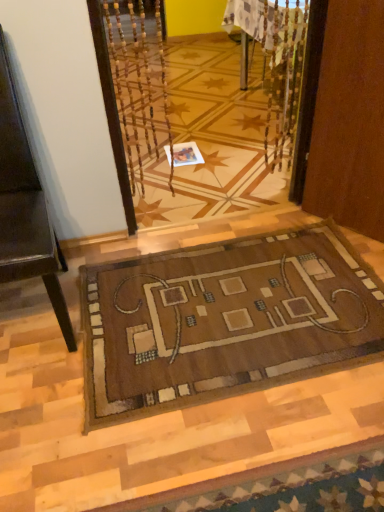
Question: From a real-world perspective, is brown leather chair at left positioned over white paper at center based on gravity?

Choices:
 (A) no
 (B) yes

Answer: (B)

Question: From a real-world perspective, is brown leather chair at left beneath white paper at center?

Choices:
 (A) no
 (B) yes

Answer: (A)

Question: From the image's perspective, is brown leather chair at left beneath white paper at center?

Choices:
 (A) no
 (B) yes

Answer: (B)

Question: Is brown leather chair at left positioned in front of white paper at center?

Choices:
 (A) no
 (B) yes

Answer: (B)

Question: Is brown leather chair at left oriented away from white paper at center?

Choices:
 (A) yes
 (B) no

Answer: (B)

Question: Considering the positions of brown leather chair at left and brown woven mat at center in the image, is brown leather chair at left wider or thinner than brown woven mat at center?

Choices:
 (A) thin
 (B) wide

Answer: (A)

Question: Is brown leather chair at left situated inside brown woven mat at center or outside?

Choices:
 (A) inside
 (B) outside

Answer: (B)

Question: From a real-world perspective, is brown leather chair at left physically located above or below brown woven mat at center?

Choices:
 (A) below
 (B) above

Answer: (B)

Question: In the image, is brown leather chair at left positioned in front of or behind brown woven mat at center?

Choices:
 (A) front
 (B) behind

Answer: (A)

Question: From a real-world perspective, relative to brown leather chair at left, is white paper at center vertically above or below?

Choices:
 (A) below
 (B) above

Answer: (A)

Question: Looking at their shapes, would you say white paper at center is wider or thinner than brown leather chair at left?

Choices:
 (A) thin
 (B) wide

Answer: (A)

Question: Looking at the image, does white paper at center seem bigger or smaller compared to brown leather chair at left?

Choices:
 (A) small
 (B) big

Answer: (A)

Question: Is white paper at center spatially inside brown leather chair at left, or outside of it?

Choices:
 (A) outside
 (B) inside

Answer: (A)

Question: Do you think white paper at center is within brown woven mat at center, or outside of it?

Choices:
 (A) outside
 (B) inside

Answer: (A)

Question: Considering their positions, is white paper at center located in front of or behind brown woven mat at center?

Choices:
 (A) front
 (B) behind

Answer: (B)